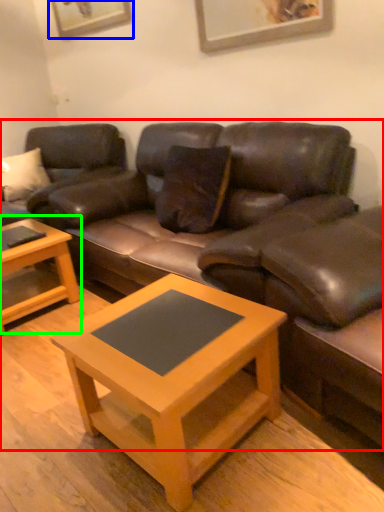
Question: Which object is positioned closest to studio couch (highlighted by a red box)? Select from picture frame (highlighted by a blue box) and coffee table (highlighted by a green box).

Choices:
 (A) picture frame
 (B) coffee table

Answer: (B)